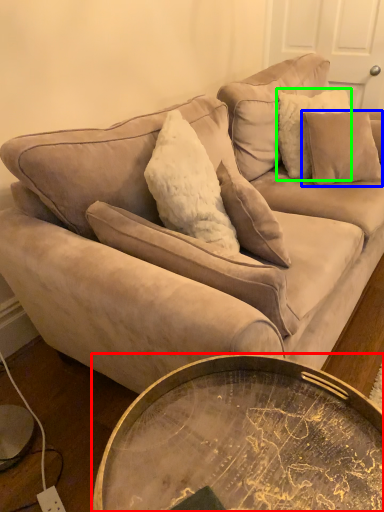
Question: Which object is positioned closest to coffee table (highlighted by a red box)? Select from pillow (highlighted by a blue box) and pillow (highlighted by a green box).

Choices:
 (A) pillow
 (B) pillow

Answer: (A)